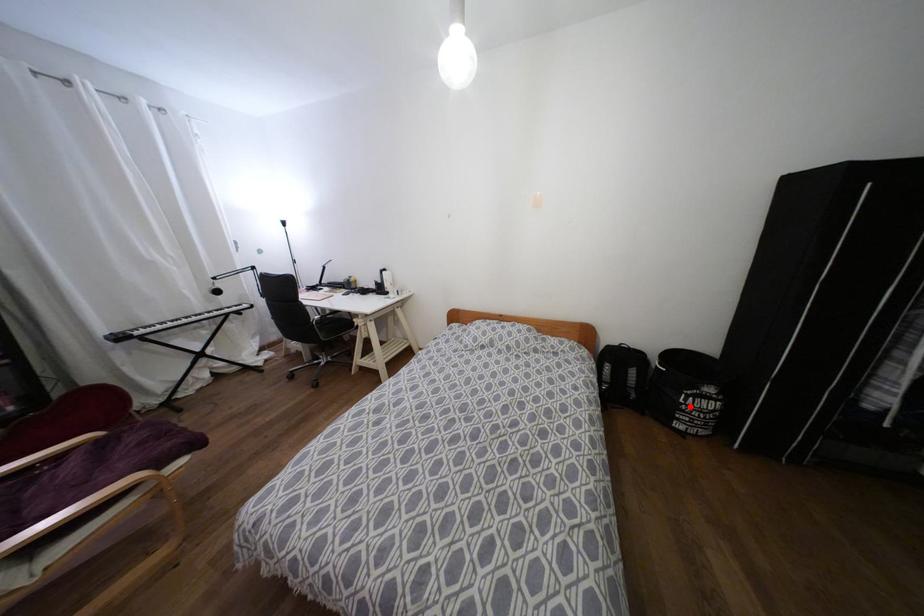
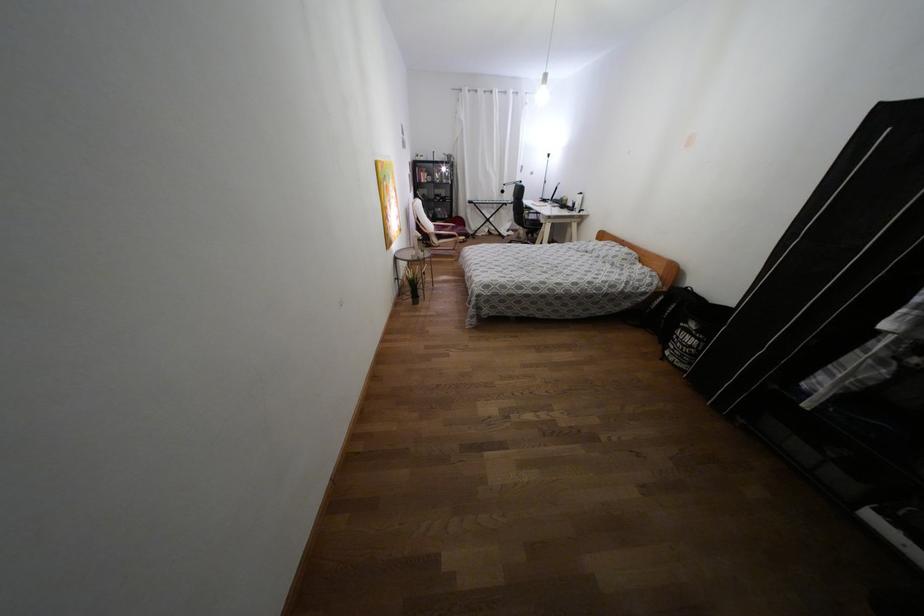
Where in the second image is the point corresponding to the highlighted location from the first image?

(676, 337)